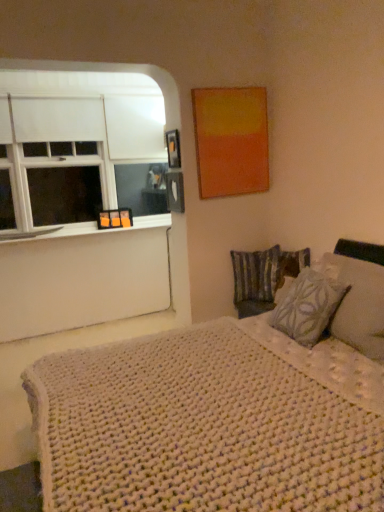
Question: From a real-world perspective, is white matte window at left physically above metallic photo frame at upper center?

Choices:
 (A) yes
 (B) no

Answer: (B)

Question: Does white matte window at left appear on the left side of metallic photo frame at upper center?

Choices:
 (A) no
 (B) yes

Answer: (B)

Question: From a real-world perspective, does white matte window at left sit lower than metallic photo frame at upper center?

Choices:
 (A) no
 (B) yes

Answer: (B)

Question: From the image's perspective, is white matte window at left located above metallic photo frame at upper center?

Choices:
 (A) no
 (B) yes

Answer: (B)

Question: Is white matte window at left not inside metallic photo frame at upper center?

Choices:
 (A) yes
 (B) no

Answer: (A)

Question: Can you confirm if white matte window at left is smaller than metallic photo frame at upper center?

Choices:
 (A) no
 (B) yes

Answer: (A)

Question: Is patterned fabric pillow at right, marked as the first pillow in a front-to-back arrangement, with white matte window at left?

Choices:
 (A) yes
 (B) no

Answer: (B)

Question: Is white matte window at left completely or partially inside patterned fabric pillow at right, marked as the first pillow in a front-to-back arrangement?

Choices:
 (A) no
 (B) yes

Answer: (A)

Question: Is patterned fabric pillow at right, the 2th pillow when ordered from back to front, completely or partially outside of white matte window at left?

Choices:
 (A) yes
 (B) no

Answer: (A)

Question: From the image's perspective, would you say patterned fabric pillow at right, the 2th pillow when ordered from back to front, is positioned over white matte window at left?

Choices:
 (A) no
 (B) yes

Answer: (A)

Question: Is the position of patterned fabric pillow at right, the 2th pillow when ordered from back to front, more distant than that of white matte window at left?

Choices:
 (A) yes
 (B) no

Answer: (B)

Question: From the image's perspective, is patterned fabric pillow at right, marked as the first pillow in a front-to-back arrangement, located beneath white matte window at left?

Choices:
 (A) yes
 (B) no

Answer: (A)

Question: Is white matte window at left wider than white knitted blanket at lower right?

Choices:
 (A) yes
 (B) no

Answer: (B)